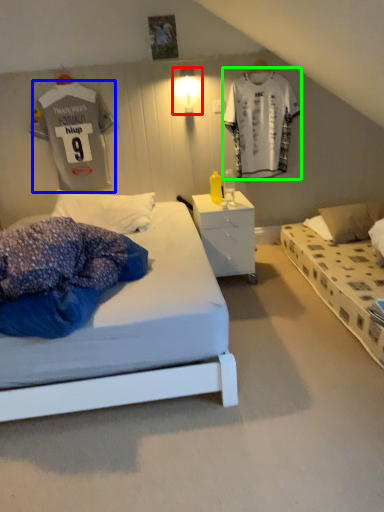
Question: Which object is the farthest from light fixture (highlighted by a red box)? Choose among these: t shirt (highlighted by a blue box) or t shirt (highlighted by a green box).

Choices:
 (A) t shirt
 (B) t shirt

Answer: (A)